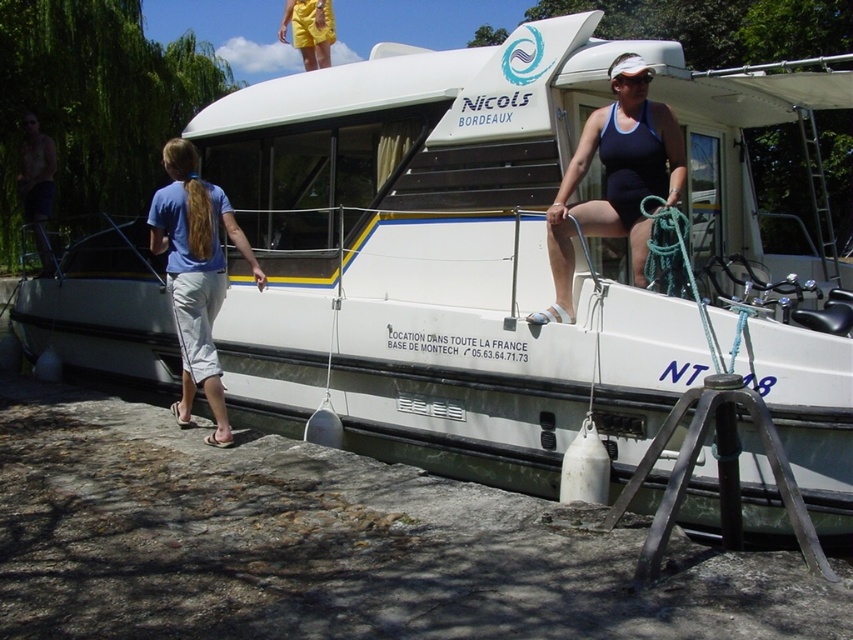
You are a visitor standing on the riverside next to the houseboat. You see the dark blue swimsuit at upper right and the shiny metallic pole at left. Which object is shorter?

The dark blue swimsuit at upper right has a lesser height compared to the shiny metallic pole at left, so the dark blue swimsuit at upper right is shorter.

You are on the deck of the houseboat and want to move from the shiny metallic pole at left to the dark blue swimsuit at upper right. Which direction should you move to get there?

The dark blue swimsuit at upper right is positioned on the right side of the shiny metallic pole at left, so you should move to the right to reach it.